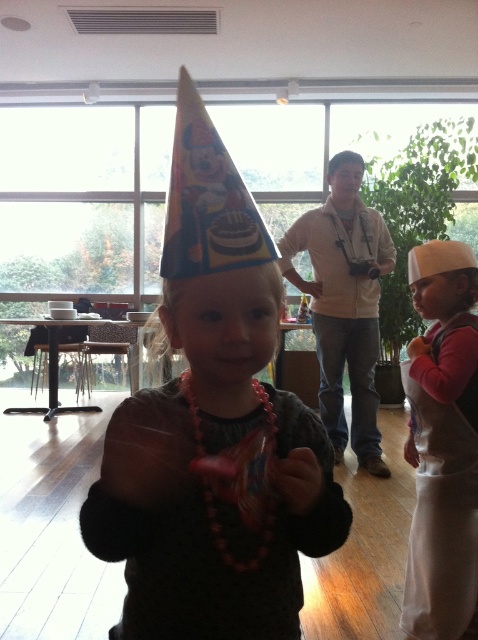
Is matte party hat at center above white fabric apron at lower right?

Yes.

Does point (187, 284) come behind point (471, 461)?

No.

This screenshot has width=478, height=640. What do you see at coordinates (206, 524) in the screenshot? I see `matte party hat at center` at bounding box center [206, 524].

Find the location of a particular element. Image resolution: width=478 pixels, height=640 pixels. matte party hat at center is located at coordinates (206, 524).